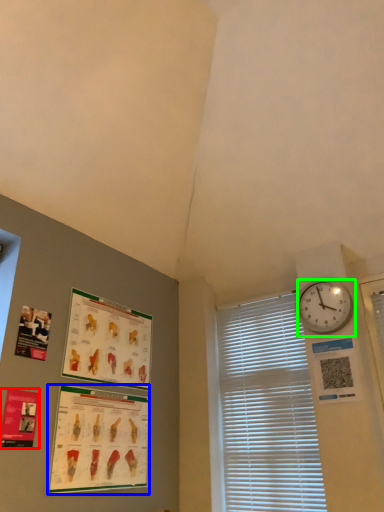
Question: Which object is positioned closest to poster page (highlighted by a red box)? Select from poster page (highlighted by a blue box) and wall clock (highlighted by a green box).

Choices:
 (A) poster page
 (B) wall clock

Answer: (A)